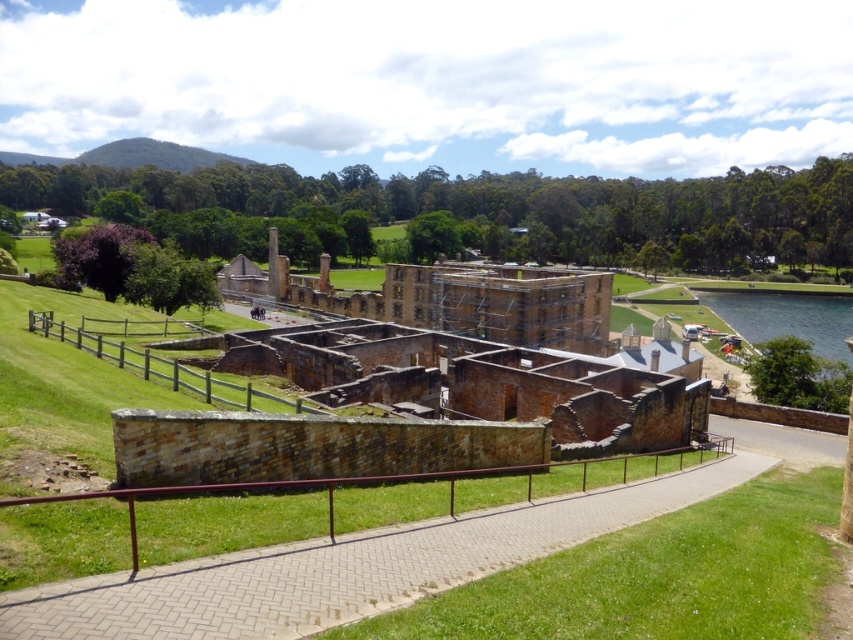
Does brown stone ruins at center appear under green grassy lake at lower right?

No, brown stone ruins at center is not below green grassy lake at lower right.

Between brown stone ruins at center and green grassy lake at lower right, which one appears on the right side from the viewer's perspective?

From the viewer's perspective, green grassy lake at lower right appears more on the right side.

Where is `brown stone ruins at center`? brown stone ruins at center is located at coordinates (451, 298).

Is brick paved walkway at center thinner than green grassy lake at lower right?

Indeed, brick paved walkway at center has a lesser width compared to green grassy lake at lower right.

From the picture: Which is more to the left, brick paved walkway at center or green grassy lake at lower right?

brick paved walkway at center

This screenshot has width=853, height=640. What do you see at coordinates (347, 566) in the screenshot?
I see `brick paved walkway at center` at bounding box center [347, 566].

What are the coordinates of `brick paved walkway at center` in the screenshot? It's located at (347, 566).

The image size is (853, 640). What do you see at coordinates (347, 566) in the screenshot?
I see `brick paved walkway at center` at bounding box center [347, 566].

Which is below, brick paved walkway at center or brown stone ruins at center?

brick paved walkway at center is below.

Which is behind, point (442, 541) or point (474, 273)?

Point (474, 273)

The height and width of the screenshot is (640, 853). I want to click on brick paved walkway at center, so click(x=347, y=566).